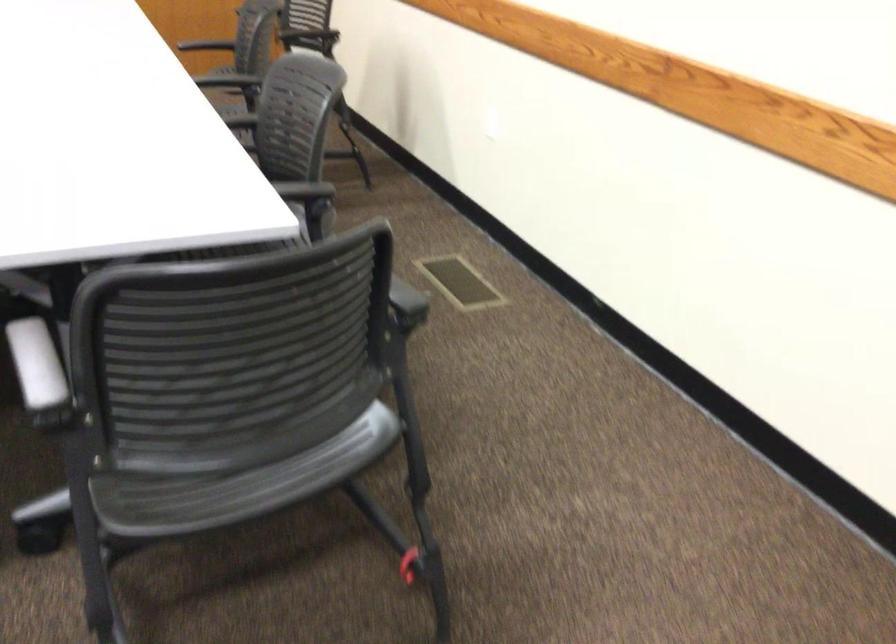
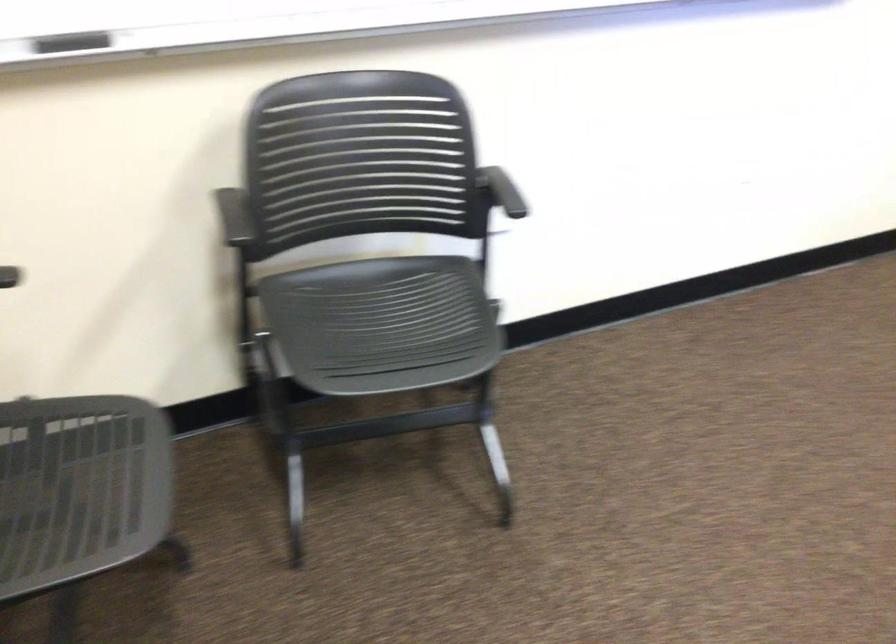
The images are taken continuously from a first-person perspective. In which direction is your viewpoint rotating?

The camera's rotation is toward left-down.